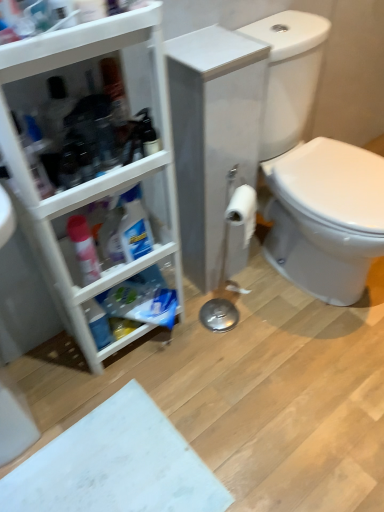
Find the location of a particular element. This screenshot has height=512, width=384. free space to the right of white plastic cabinet at left is located at coordinates (210, 346).